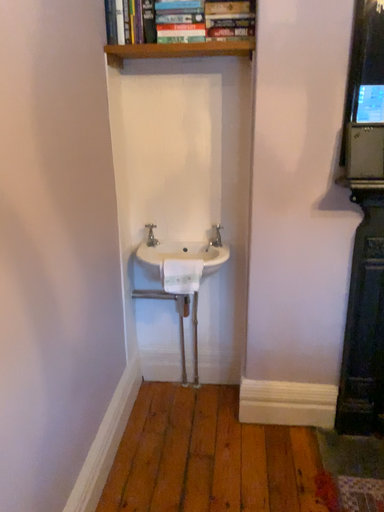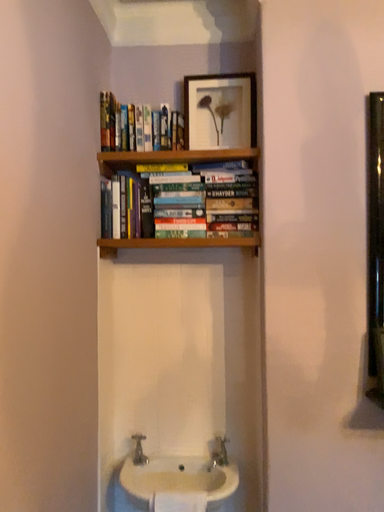
Question: Which way did the camera rotate in the video?

Choices:
 (A) rotated upward
 (B) rotated downward

Answer: (A)